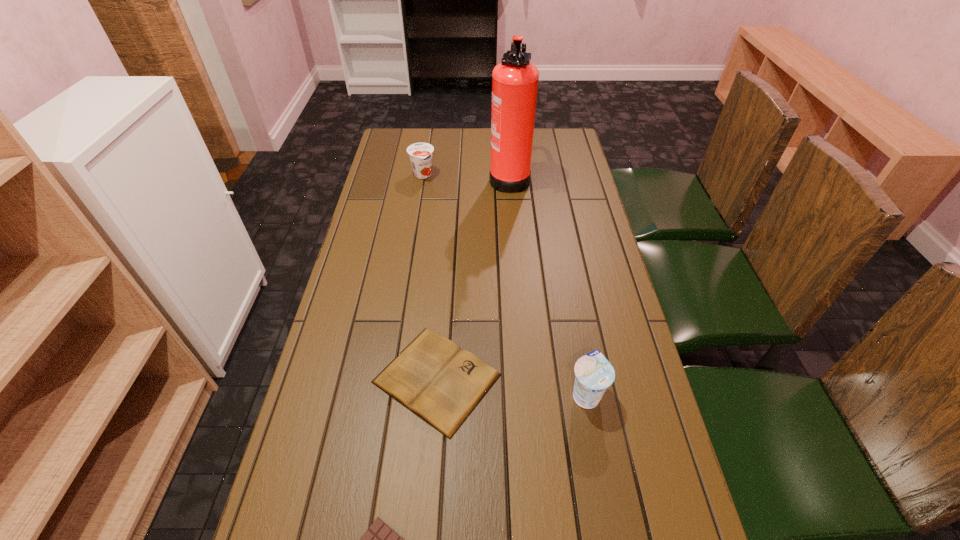
Locate an element on the screen. Image resolution: width=960 pixels, height=540 pixels. vacant region located 0.300m on the back of the second shortest object is located at coordinates (446, 251).

The height and width of the screenshot is (540, 960). Identify the location of object located in the far edge section of the desktop. (515, 80).

This screenshot has height=540, width=960. In order to click on yogurt present at the left edge in this screenshot , I will do `click(420, 154)`.

I want to click on book that is at the left edge, so click(433, 377).

The width and height of the screenshot is (960, 540). In order to click on object that is at the right edge in this screenshot , I will do `click(594, 373)`.

The height and width of the screenshot is (540, 960). In order to click on vacant area at the far edge of the desktop in this screenshot , I will do `click(470, 149)`.

The height and width of the screenshot is (540, 960). In the image, there is a desktop. Find the location of `vacant region at the left edge`. vacant region at the left edge is located at coordinates (374, 178).

Where is `vacant region at the right edge of the desktop`? The image size is (960, 540). vacant region at the right edge of the desktop is located at coordinates (569, 281).

The height and width of the screenshot is (540, 960). In the image, there is a desktop. In order to click on free space at the far left corner in this screenshot , I will do `click(416, 142)`.

Identify the location of vacant area at the far right corner. click(538, 130).